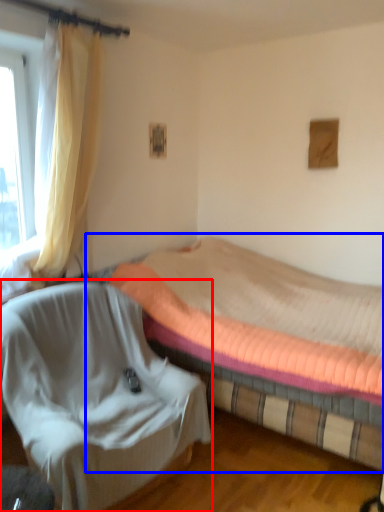
Question: Which object appears farthest to the camera in this image, chair (highlighted by a red box) or bed (highlighted by a blue box)?

Choices:
 (A) chair
 (B) bed

Answer: (B)